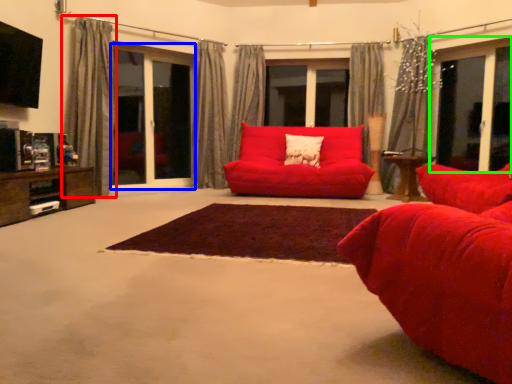
Question: Considering the real-world distances, which object is farthest from curtain (highlighted by a red box)? screen door (highlighted by a blue box) or window (highlighted by a green box)?

Choices:
 (A) screen door
 (B) window

Answer: (B)